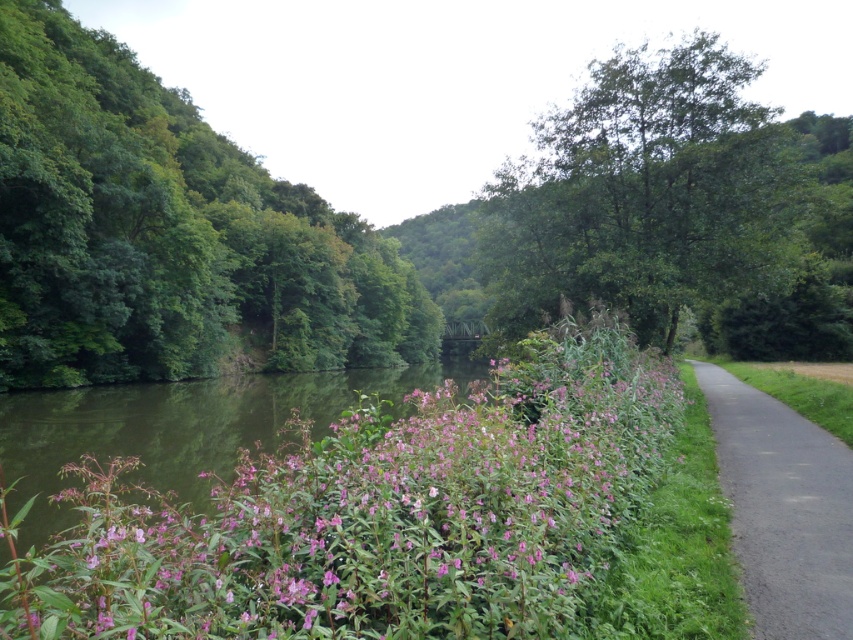
Question: Which object appears closest to the camera in this image?

Choices:
 (A) green leafy tree at upper center
 (B) green leafy tree at left
 (C) pink matte flowers at center

Answer: (C)

Question: Does pink matte flowers at center lie behind green leafy tree at upper center?

Choices:
 (A) no
 (B) yes

Answer: (A)

Question: Estimate the real-world distances between objects in this image. Which object is closer to the green leafy tree at upper center?

Choices:
 (A) green leafy tree at left
 (B) black asphalt road at right
 (C) pink matte flowers at center

Answer: (B)

Question: Does pink matte flowers at center appear under black asphalt road at right?

Choices:
 (A) yes
 (B) no

Answer: (A)

Question: Can you confirm if green leafy tree at left is positioned to the right of black asphalt road at right?

Choices:
 (A) no
 (B) yes

Answer: (A)

Question: Which point is farther to the camera?

Choices:
 (A) (730, 422)
 (B) (61, 360)

Answer: (B)